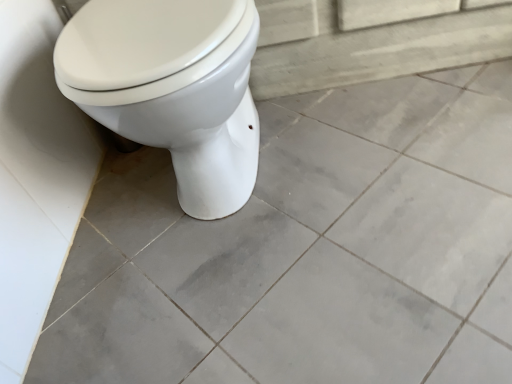
The image size is (512, 384). What are the coordinates of `white glossy toilet at center` in the screenshot? It's located at (172, 88).

The height and width of the screenshot is (384, 512). Describe the element at coordinates (172, 88) in the screenshot. I see `white glossy toilet at center` at that location.

Measure the distance between point (63, 83) and camera.

The depth of point (63, 83) is 26.14 inches.

Find the location of `white glossy toilet at center`. white glossy toilet at center is located at coordinates click(172, 88).